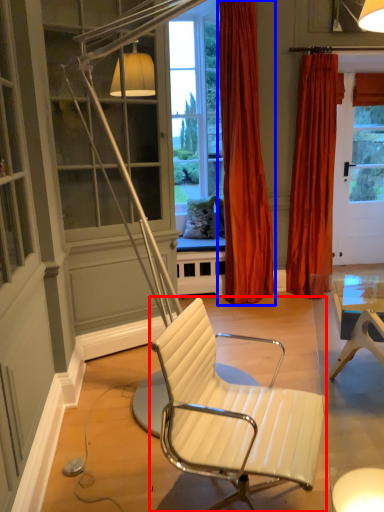
Question: Which object appears closest to the camera in this image, chair (highlighted by a red box) or curtain (highlighted by a blue box)?

Choices:
 (A) chair
 (B) curtain

Answer: (A)